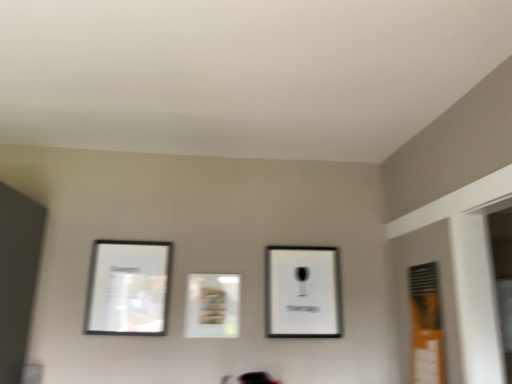
Question: Is the position of matte black picture frame at left, marked as the 1th picture frame in a left-to-right arrangement, more distant than that of black matte picture frame at upper center, positioned as the first picture frame in right-to-left order?

Choices:
 (A) no
 (B) yes

Answer: (A)

Question: From the image's perspective, is matte black picture frame at left, which is the third picture frame from right to left, under black matte picture frame at upper center, positioned as the first picture frame in right-to-left order?

Choices:
 (A) no
 (B) yes

Answer: (A)

Question: Can you confirm if matte black picture frame at left, marked as the 1th picture frame in a left-to-right arrangement, is shorter than black matte picture frame at upper center, which is the third picture frame from left to right?

Choices:
 (A) yes
 (B) no

Answer: (A)

Question: Are matte black picture frame at left, which is the third picture frame from right to left, and black matte picture frame at upper center, which is the third picture frame from left to right, beside each other?

Choices:
 (A) no
 (B) yes

Answer: (A)

Question: Could black matte picture frame at upper center, which is the third picture frame from left to right, be considered to be inside matte black picture frame at left, which is the third picture frame from right to left?

Choices:
 (A) yes
 (B) no

Answer: (B)

Question: Looking at their shapes, would you say black matte picture frame at upper center, which is the third picture frame from left to right, is wider or thinner than matte white picture frame at center, which is counted as the 2th picture frame, starting from the left?

Choices:
 (A) wide
 (B) thin

Answer: (A)

Question: Based on their positions, is black matte picture frame at upper center, positioned as the first picture frame in right-to-left order, located to the left or right of matte white picture frame at center, which is counted as the 2th picture frame, starting from the left?

Choices:
 (A) right
 (B) left

Answer: (A)

Question: From a real-world perspective, relative to matte white picture frame at center, which is counted as the 2th picture frame, starting from the left, is black matte picture frame at upper center, which is the third picture frame from left to right, vertically above or below?

Choices:
 (A) below
 (B) above

Answer: (B)

Question: Is point (309, 261) positioned closer to the camera than point (214, 279)?

Choices:
 (A) closer
 (B) farther

Answer: (B)

Question: Would you say matte black picture frame at left, marked as the 1th picture frame in a left-to-right arrangement, is inside or outside orange matte window at right?

Choices:
 (A) inside
 (B) outside

Answer: (B)

Question: From their relative heights in the image, would you say matte black picture frame at left, marked as the 1th picture frame in a left-to-right arrangement, is taller or shorter than orange matte window at right?

Choices:
 (A) short
 (B) tall

Answer: (A)

Question: Is point (150, 306) closer or farther from the camera than point (417, 360)?

Choices:
 (A) farther
 (B) closer

Answer: (A)

Question: Is matte black picture frame at left, which is the third picture frame from right to left, wider or thinner than orange matte window at right?

Choices:
 (A) wide
 (B) thin

Answer: (B)

Question: Considering their positions, is matte white picture frame at center, which ranks as the second picture frame in right-to-left order, located in front of or behind orange matte window at right?

Choices:
 (A) front
 (B) behind

Answer: (B)

Question: Looking at their shapes, would you say matte white picture frame at center, which is counted as the 2th picture frame, starting from the left, is wider or thinner than orange matte window at right?

Choices:
 (A) wide
 (B) thin

Answer: (B)